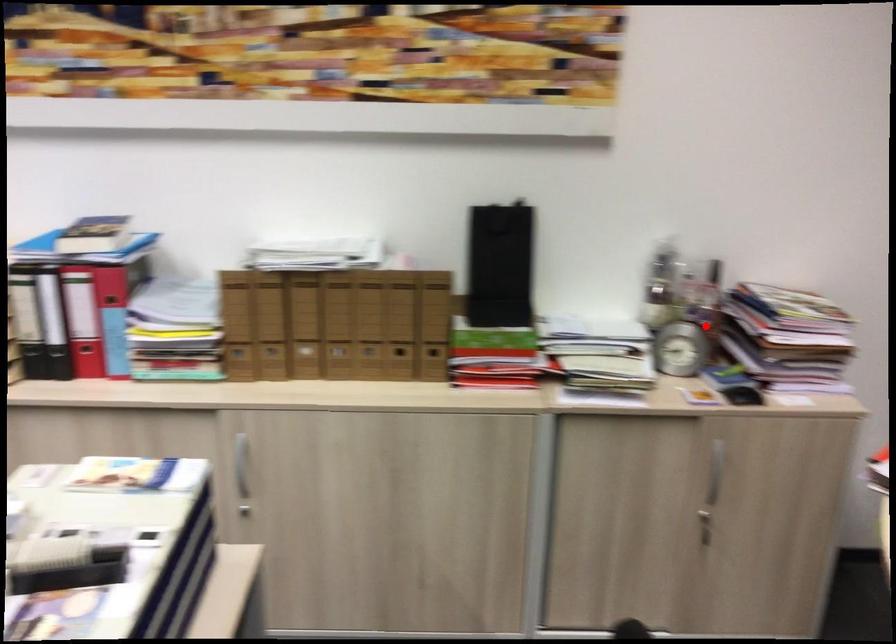
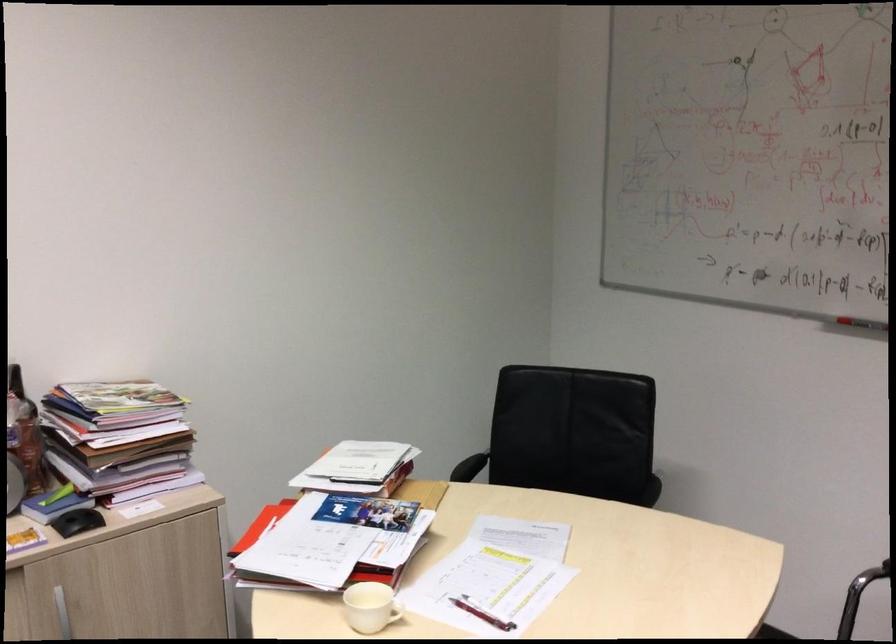
Question: I am providing you with two images of the same scene from different viewpoints. Image1 has a red point marked. In image2, the corresponding 3D location appears at what relative position? Reply with the corresponding letter.

Choices:
 (A) Closer
 (B) Farther

Answer: (A)